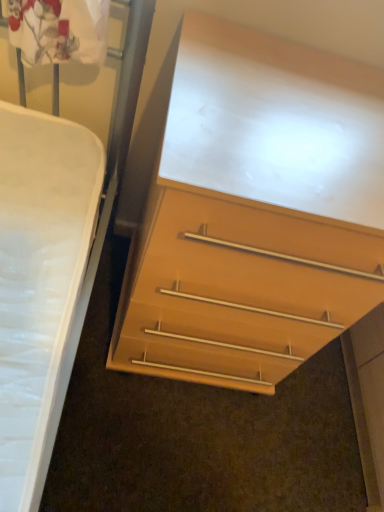
You are a GUI agent. You are given a task and a screenshot of the screen. Output one action in this format:
    pyautogui.click(x=<x>, y=<y>)
    Task: Click on the free space above light wood/wooden chest of drawers at center (from a real-world perspective)
    
    Given the screenshot: What is the action you would take?
    pyautogui.click(x=291, y=108)